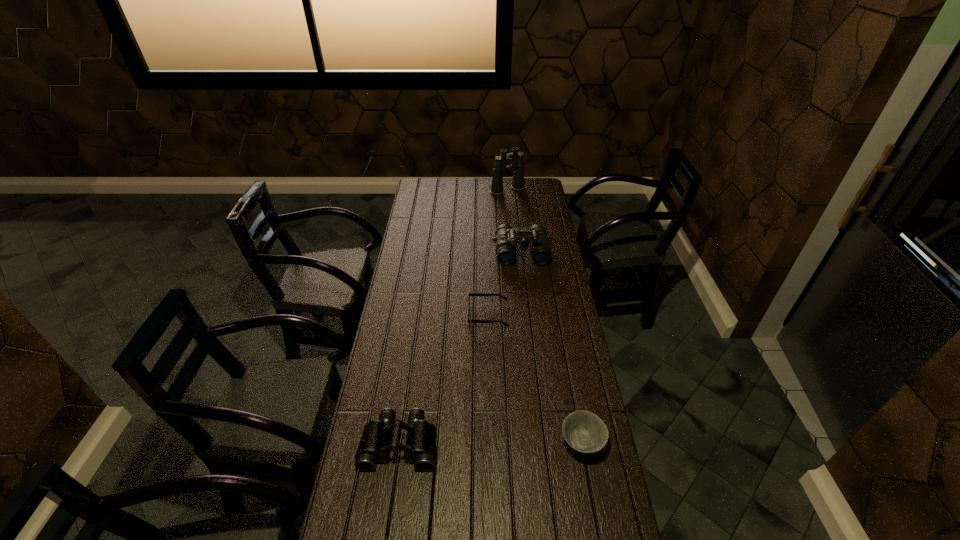
Identify which object is located as the fourth nearest to the shortest object. Please provide its 2D coordinates. Your answer should be formatted as a tuple, i.e. [(x, y)], where the tuple contains the x and y coordinates of a point satisfying the conditions above.

[(516, 158)]

The height and width of the screenshot is (540, 960). Find the location of `the fourth closest object relative to the fourth nearest object`. the fourth closest object relative to the fourth nearest object is located at coordinates (374, 446).

Identify which binoculars is the third closest to the shortest object. Please provide its 2D coordinates. Your answer should be formatted as a tuple, i.e. [(x, y)], where the tuple contains the x and y coordinates of a point satisfying the conditions above.

[(516, 158)]

Select which binoculars is the second closest to the second shortest object. Please provide its 2D coordinates. Your answer should be formatted as a tuple, i.e. [(x, y)], where the tuple contains the x and y coordinates of a point satisfying the conditions above.

[(506, 238)]

What are the coordinates of `vacant space that satisfies the following two spatial constraints: 1. on the arms of the shortest object; 2. on the back side of the second shortest object` in the screenshot? It's located at (491, 443).